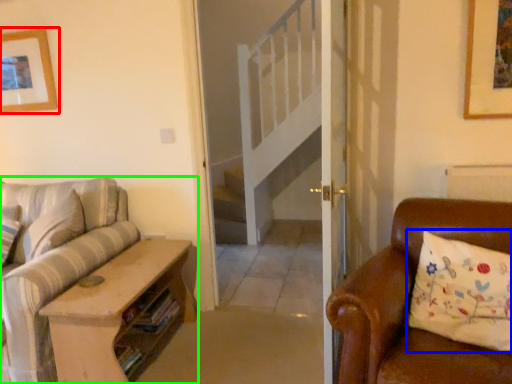
Question: Which is farther away from picture frame (highlighted by a red box)? pillow (highlighted by a blue box) or studio couch (highlighted by a green box)?

Choices:
 (A) pillow
 (B) studio couch

Answer: (A)